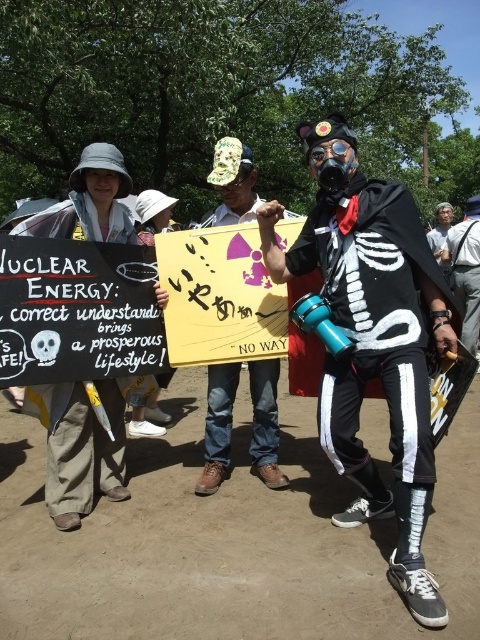
Looking at this image, does black matte skeleton costume at center appear under white cotton shirt at center?

Yes.

Does point (403, 314) come behind point (471, 275)?

No, it is not.

This screenshot has width=480, height=640. In order to click on black matte skeleton costume at center in this screenshot , I will do `click(372, 340)`.